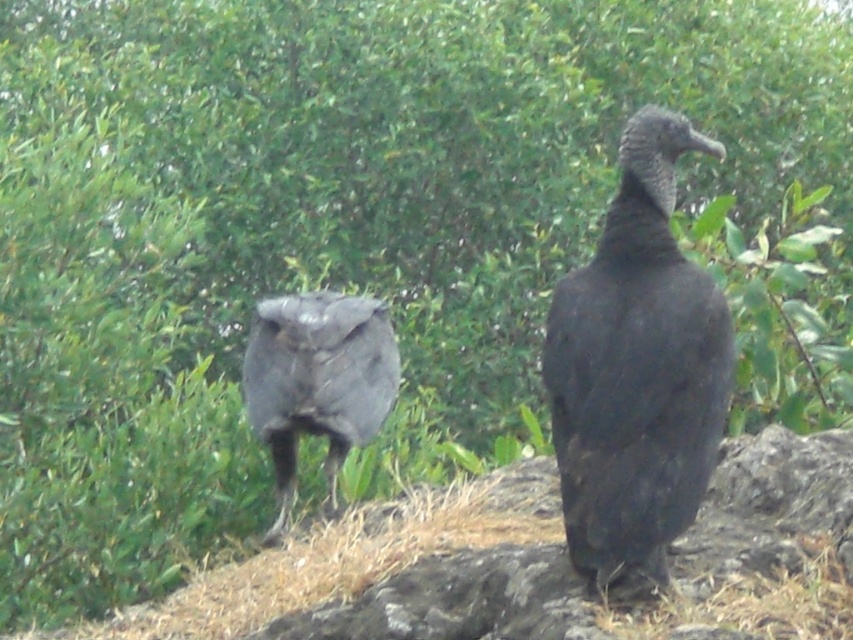
Is matte black vulture at center taller than shiny black bird at center?

Correct, matte black vulture at center is much taller as shiny black bird at center.

Where is `matte black vulture at center`? matte black vulture at center is located at coordinates (636, 369).